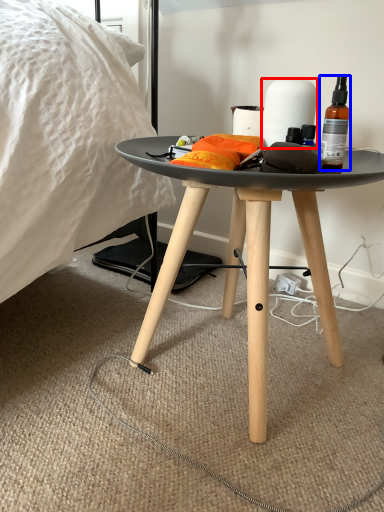
Question: Among these objects, which one is nearest to the camera, paper towel (highlighted by a red box) or bottle (highlighted by a blue box)?

Choices:
 (A) paper towel
 (B) bottle

Answer: (B)